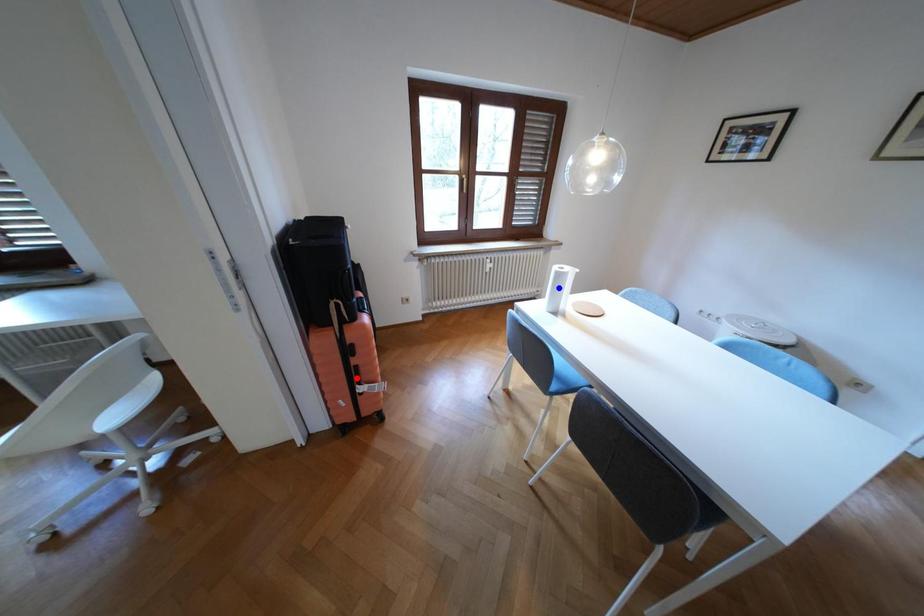
Question: In the image, two points are highlighted. Which point is nearer to the camera? Reply with the corresponding letter.

Choices:
 (A) blue point
 (B) red point

Answer: (B)